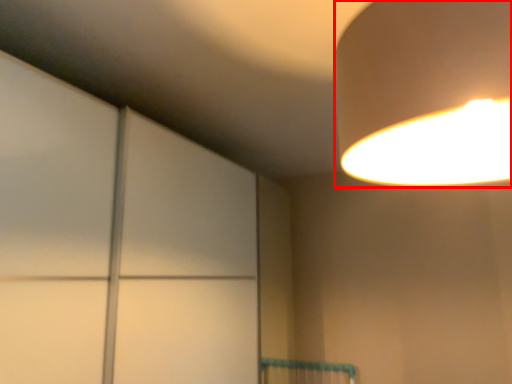
Question: From the image, what is the correct spatial relationship of lamp (annotated by the red box) in relation to glass door?

Choices:
 (A) left
 (B) right

Answer: (B)